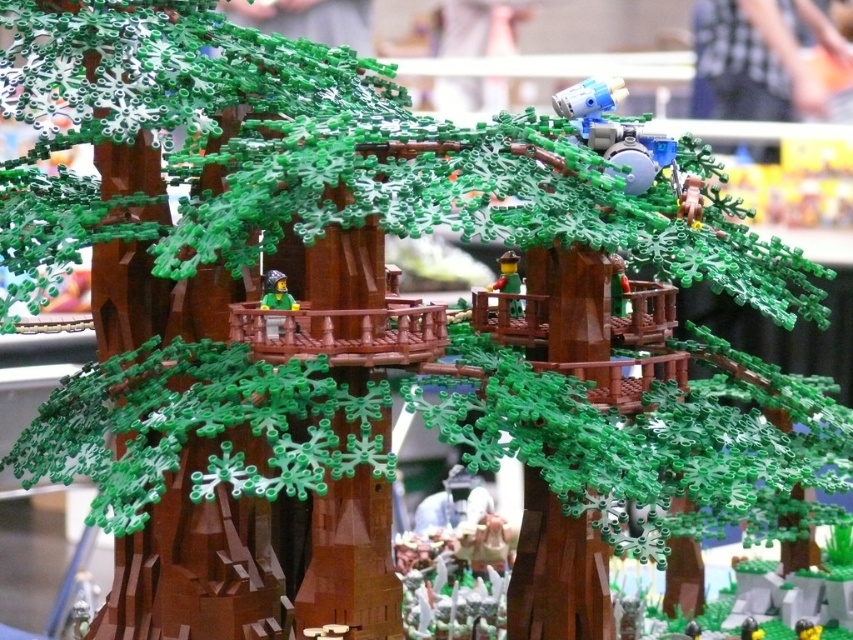
Is green matte minifigure at center below smooth brown figure at center?

Correct, green matte minifigure at center is located below smooth brown figure at center.

Can you confirm if green matte minifigure at center is thinner than smooth brown figure at center?

No.

This screenshot has width=853, height=640. Describe the element at coordinates (276, 292) in the screenshot. I see `green matte minifigure at center` at that location.

What are the coordinates of `green matte minifigure at center` in the screenshot? It's located at (276, 292).